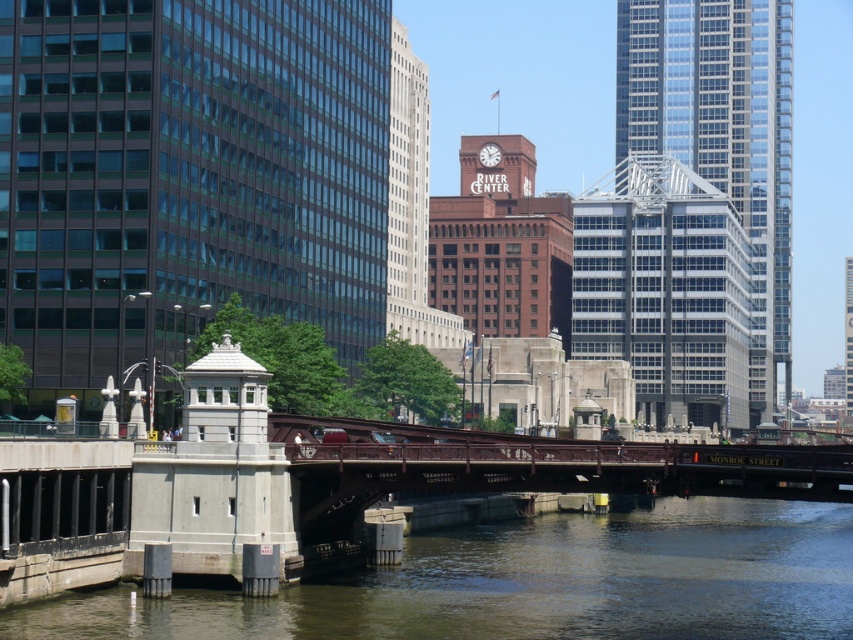
Does matte glass building at left have a smaller size compared to white glossy clock at center?

No, matte glass building at left is not smaller than white glossy clock at center.

The height and width of the screenshot is (640, 853). Identify the location of matte glass building at left. (187, 176).

Locate an element on the screen. The height and width of the screenshot is (640, 853). matte glass building at left is located at coordinates (187, 176).

Can you confirm if glassy reflective skyscraper at upper right is positioned to the left of white glossy clock at center?

No, glassy reflective skyscraper at upper right is not to the left of white glossy clock at center.

Consider the image. Who is positioned more to the right, glassy reflective skyscraper at upper right or white glossy clock at center?

From the viewer's perspective, glassy reflective skyscraper at upper right appears more on the right side.

The width and height of the screenshot is (853, 640). What do you see at coordinates (721, 136) in the screenshot?
I see `glassy reflective skyscraper at upper right` at bounding box center [721, 136].

Locate an element on the screen. Image resolution: width=853 pixels, height=640 pixels. glassy reflective skyscraper at upper right is located at coordinates (721, 136).

Consider the image. Between greenish concrete water at lower center and white glossy clock at center, which one appears on the right side from the viewer's perspective?

Positioned to the right is greenish concrete water at lower center.

Does point (236, 614) lie behind point (494, 147)?

No, (236, 614) is closer to viewer.

You are a GUI agent. You are given a task and a screenshot of the screen. Output one action in this format:
    pyautogui.click(x=<x>, y=<y>)
    Task: Click on the greenish concrete water at lower center
    This screenshot has height=640, width=853.
    Given the screenshot: What is the action you would take?
    pyautogui.click(x=534, y=582)